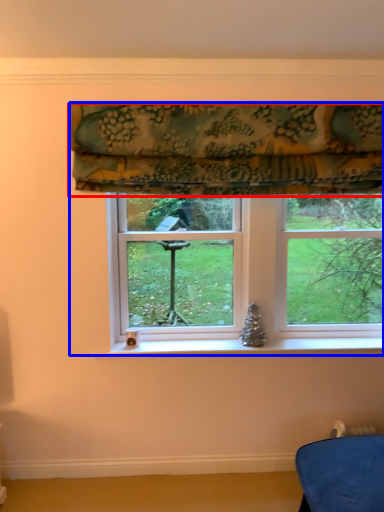
Question: Which point is closer to the camera, curtain (highlighted by a red box) or window (highlighted by a blue box)?

Choices:
 (A) curtain
 (B) window

Answer: (A)